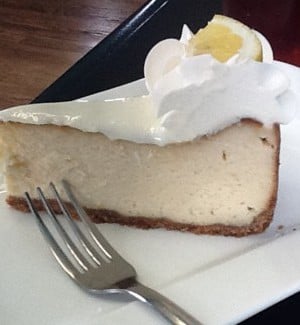
Locate an element on the screen. The height and width of the screenshot is (325, 300). surface the food goes on is located at coordinates (163, 243).